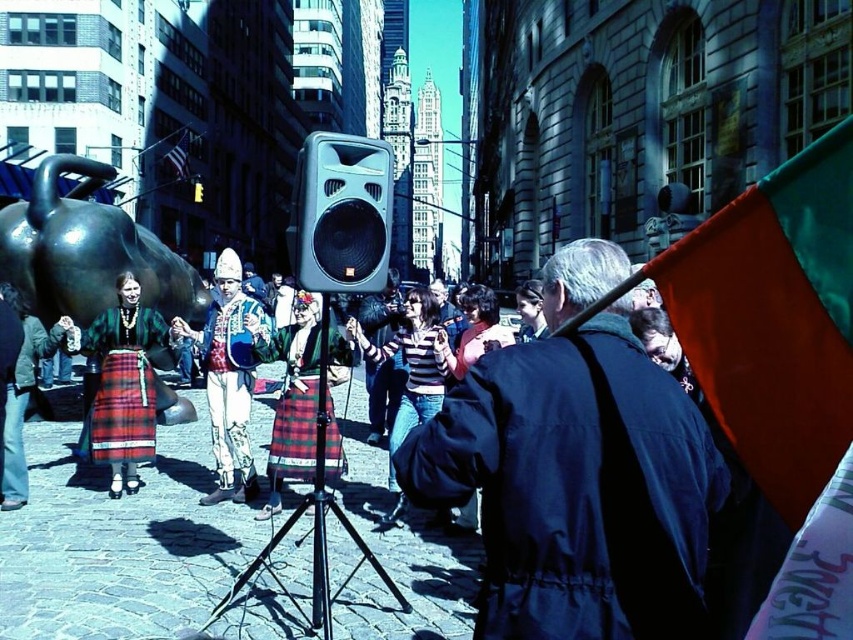
Question: Is matte black speaker at center to the right of green fabric flag at upper right from the viewer's perspective?

Choices:
 (A) yes
 (B) no

Answer: (B)

Question: Which point is farther to the camera?

Choices:
 (A) dark blue jacket at center
 (B) matte black speaker at center
 (C) green fabric flag at upper right
 (D) blue fabric flag at upper left

Answer: (D)

Question: Does matte black speaker at center appear over green fabric flag at upper right?

Choices:
 (A) yes
 (B) no

Answer: (A)

Question: Among these objects, which one is nearest to the camera?

Choices:
 (A) blue fabric flag at upper left
 (B) matte black speaker at center

Answer: (B)

Question: Which object is the farthest from the embroidered fabric outfit at center?

Choices:
 (A) green fabric flag at upper right
 (B) plaid skirt at center
 (C) blue fabric flag at upper left

Answer: (C)

Question: Is green fabric flag at upper right wider than blue fabric flag at upper left?

Choices:
 (A) no
 (B) yes

Answer: (A)